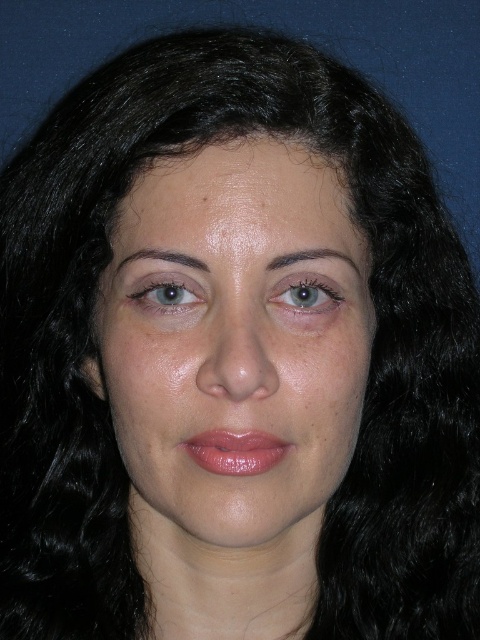
You are a makeup artist preparing to apply eyeliner to a client whose face is shown in the image. The eyeliner pencil you are using has a length of 3 inches. Can you determine if the pencil is long enough to span the distance between the smooth skin face at center and the light brown eye at center without needing to lift the pencil?

The distance between the smooth skin face at center and the light brown eye at center is 2.99 inches. Since the eyeliner pencil is 3 inches long, it is slightly longer than the required distance. Therefore, the pencil is long enough to span the distance without needing to lift.

You are a makeup artist preparing to apply eyeliner to the light brown eye at center and the matte skin eye at upper left. Which eye requires a thicker eyeliner application?

The matte skin eye at upper left requires a thicker eyeliner application because it is wider than the light brown eye at center.